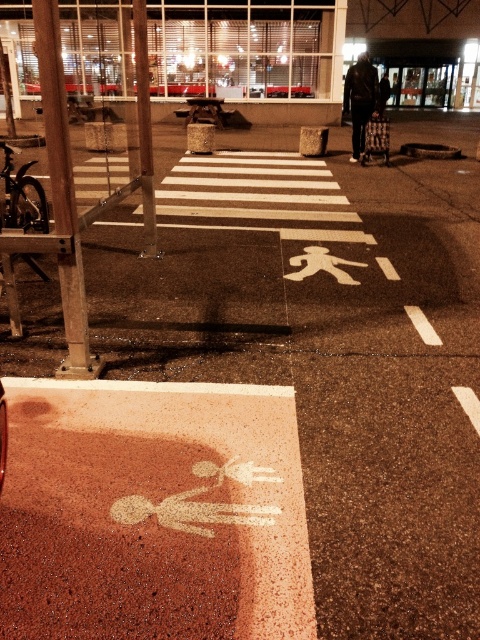
You are a pedestrian waiting at the bus stop. You notice a brushed metal pole at left and a dark brown leather jacket at center. Which object is closer to the ground?

The brushed metal pole at left is closer to the ground because it is below the dark brown leather jacket at center.

You are standing at the pedestrian crossing in the image. There is a brushed metal pole at left located at point [62,193]. Can you tell me the exact coordinates of the brushed metal pole at left?

The brushed metal pole at left is located at point [62,193].

You are a pedestrian waiting at the bus stop and you see the brushed metal pole at left and the dark brown leather jacket at center. Which object is located to the left of the other?

The brushed metal pole at left is positioned on the left side of dark brown leather jacket at center.